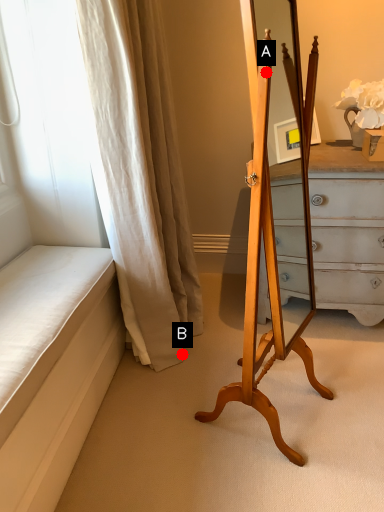
Question: Two points are circled on the image, labeled by A and B beside each circle. Which point is farther from the camera taking this photo?

Choices:
 (A) A is further
 (B) B is further

Answer: (B)